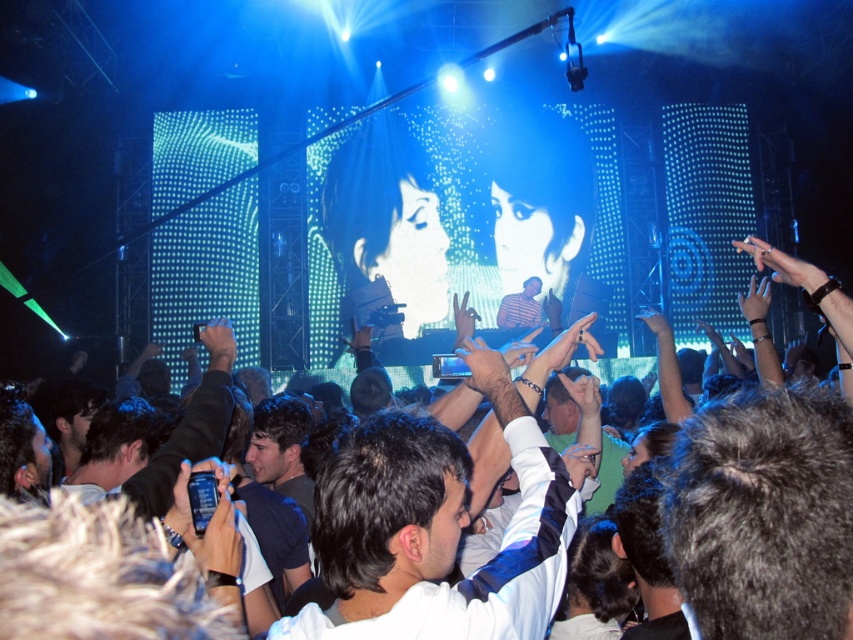
You are standing at the point marked by the coordinate point (436, 528) in the concert scene. What is the closest object to you?

The closest object to the point marked by the coordinate point (436, 528) is the white shirt at center.

You are a photographer at the concert and want to capture both the white shirt at center and the striped shirt at center in a single shot. Given that your camera has a maximum zoom range of 100 feet, can you fit both subjects into the frame without moving closer?

The white shirt at center and striped shirt at center are 136.06 feet apart from each other. Since the distance between them exceeds the camera maximum zoom range of 100 feet, you cannot fit both subjects into the frame without moving closer.

Looking at this image, you are a photographer at the concert and want to capture both the white shirt at center and the striped shirt at center in the same frame. Based on their positions, which shirt should you focus on first to ensure both are in the shot?

The white shirt at center might be wider than striped shirt at center, so you should focus on the white shirt at center first to ensure both are in the shot.